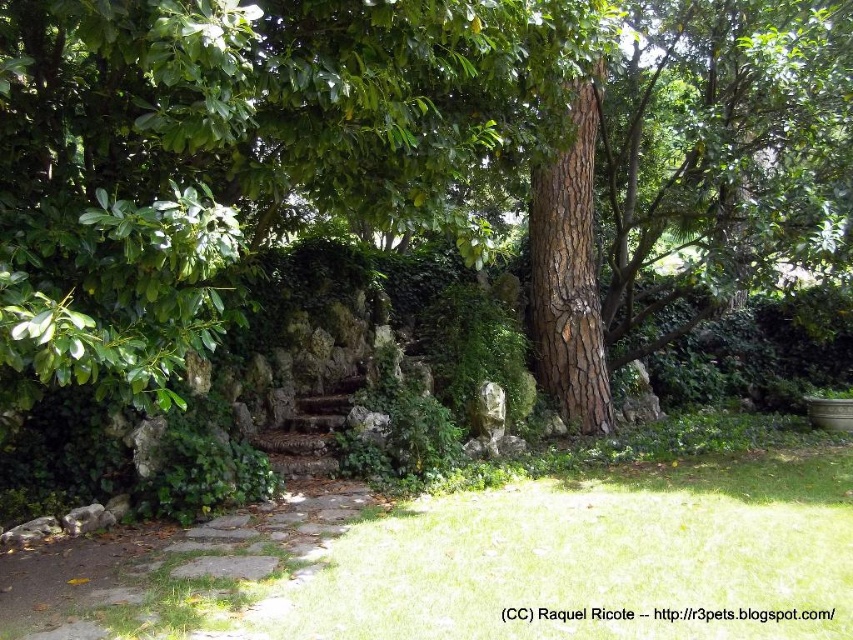
Question: Does brown rough tree at center appear on the right side of brown stone path at lower center?

Choices:
 (A) yes
 (B) no

Answer: (A)

Question: Which object appears farthest from the camera in this image?

Choices:
 (A) brown rough tree at center
 (B) brown stone path at lower center

Answer: (A)

Question: Which point is farther to the camera?

Choices:
 (A) brown rough tree at center
 (B) brown stone path at lower center

Answer: (A)

Question: Can you confirm if brown rough tree at center is bigger than brown stone path at lower center?

Choices:
 (A) yes
 (B) no

Answer: (B)

Question: Observing the image, what is the correct spatial positioning of brown rough tree at center in reference to brown stone path at lower center?

Choices:
 (A) above
 (B) below

Answer: (A)